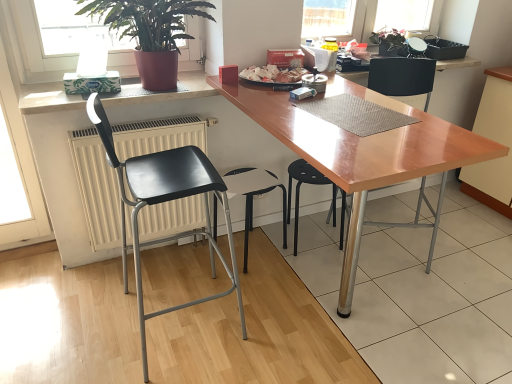
The height and width of the screenshot is (384, 512). Identify the location of free space between wooden table at center and black plastic stool at center, positioned as the 2th chair in left-to-right order. (262, 327).